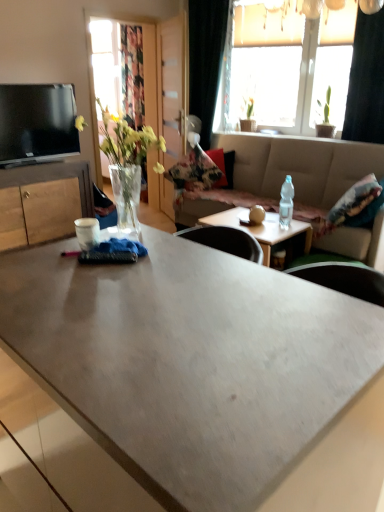
Question: Can you confirm if clear glass vase at left is thinner than wooden cabinet at left?

Choices:
 (A) yes
 (B) no

Answer: (A)

Question: Considering the relative sizes of clear glass vase at left and wooden cabinet at left in the image provided, is clear glass vase at left taller than wooden cabinet at left?

Choices:
 (A) yes
 (B) no

Answer: (B)

Question: Does clear glass vase at left appear on the left side of wooden cabinet at left?

Choices:
 (A) no
 (B) yes

Answer: (A)

Question: Considering the relative sizes of clear glass vase at left and wooden cabinet at left in the image provided, is clear glass vase at left wider than wooden cabinet at left?

Choices:
 (A) no
 (B) yes

Answer: (A)

Question: From a real-world perspective, is clear glass vase at left under wooden cabinet at left?

Choices:
 (A) yes
 (B) no

Answer: (B)

Question: From a real-world perspective, is transparent wood door at center positioned above or below matte wooden coffee table at center, acting as the 2th coffee table starting from the front?

Choices:
 (A) above
 (B) below

Answer: (A)

Question: Considering the positions of transparent wood door at center and matte wooden coffee table at center, the first coffee table positioned from the back, in the image, is transparent wood door at center taller or shorter than matte wooden coffee table at center, the first coffee table positioned from the back,?

Choices:
 (A) short
 (B) tall

Answer: (B)

Question: Is transparent wood door at center situated inside matte wooden coffee table at center, acting as the 2th coffee table starting from the front, or outside?

Choices:
 (A) inside
 (B) outside

Answer: (B)

Question: Is point (170, 87) positioned closer to the camera than point (304, 238)?

Choices:
 (A) farther
 (B) closer

Answer: (A)

Question: In terms of size, does beige fabric studio couch at center appear bigger or smaller than wooden cabinet at left?

Choices:
 (A) big
 (B) small

Answer: (A)

Question: Is beige fabric studio couch at center wider or thinner than wooden cabinet at left?

Choices:
 (A) thin
 (B) wide

Answer: (B)

Question: Considering the positions of beige fabric studio couch at center and wooden cabinet at left in the image, is beige fabric studio couch at center taller or shorter than wooden cabinet at left?

Choices:
 (A) short
 (B) tall

Answer: (B)

Question: Based on their positions, is beige fabric studio couch at center located to the left or right of wooden cabinet at left?

Choices:
 (A) right
 (B) left

Answer: (A)

Question: Visually, is matte black tv at upper left positioned to the left or to the right of matte concrete coffee table at center, acting as the 1th coffee table starting from the front?

Choices:
 (A) right
 (B) left

Answer: (B)

Question: Is matte black tv at upper left spatially inside matte concrete coffee table at center, which is counted as the second coffee table, starting from the back, or outside of it?

Choices:
 (A) outside
 (B) inside

Answer: (A)